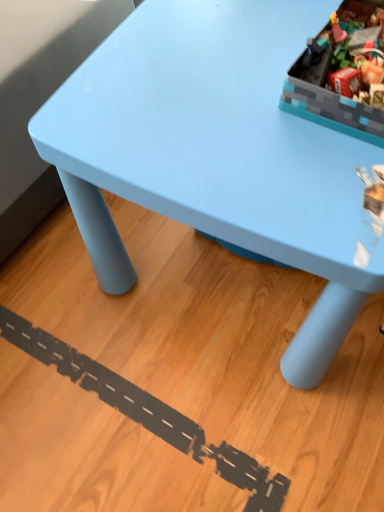
This screenshot has height=512, width=384. Find the location of `vacant point above light blue plastic table at upper center (from a real-world perspective)`. vacant point above light blue plastic table at upper center (from a real-world perspective) is located at coordinates (234, 77).